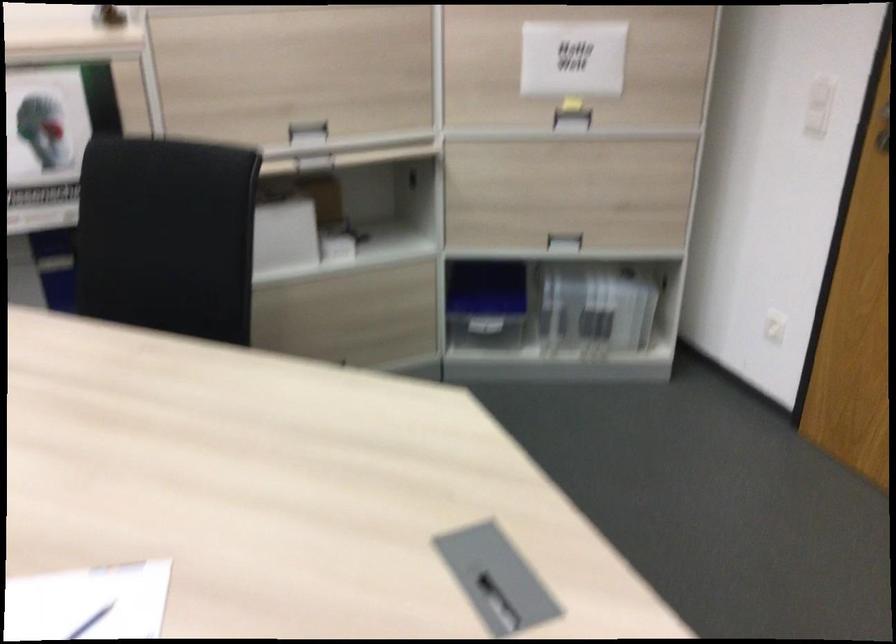
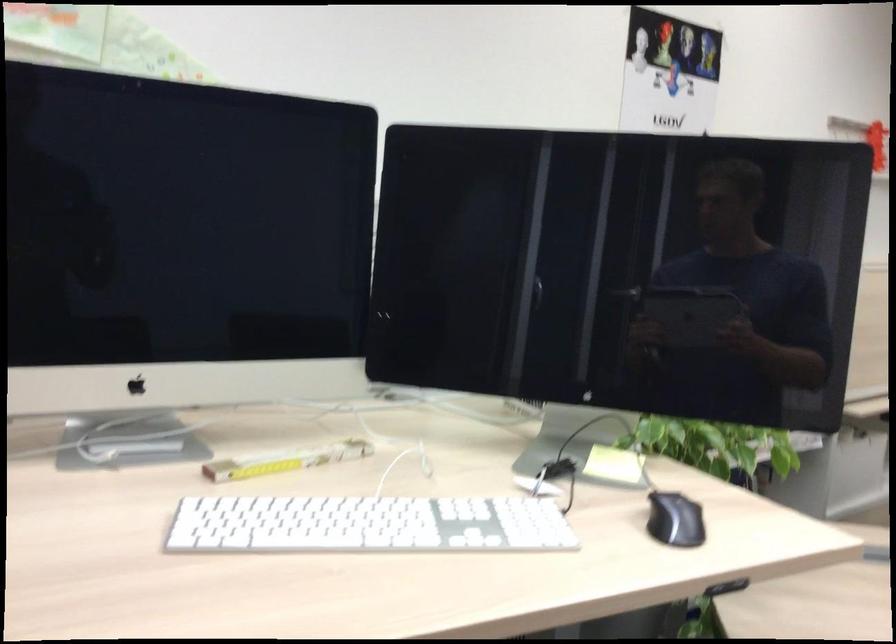
Question: In a continuous first-person perspective shot, in which direction is the camera moving?

Choices:
 (A) Left
 (B) Right
 (C) Forward
 (D) Backward

Answer: (A)